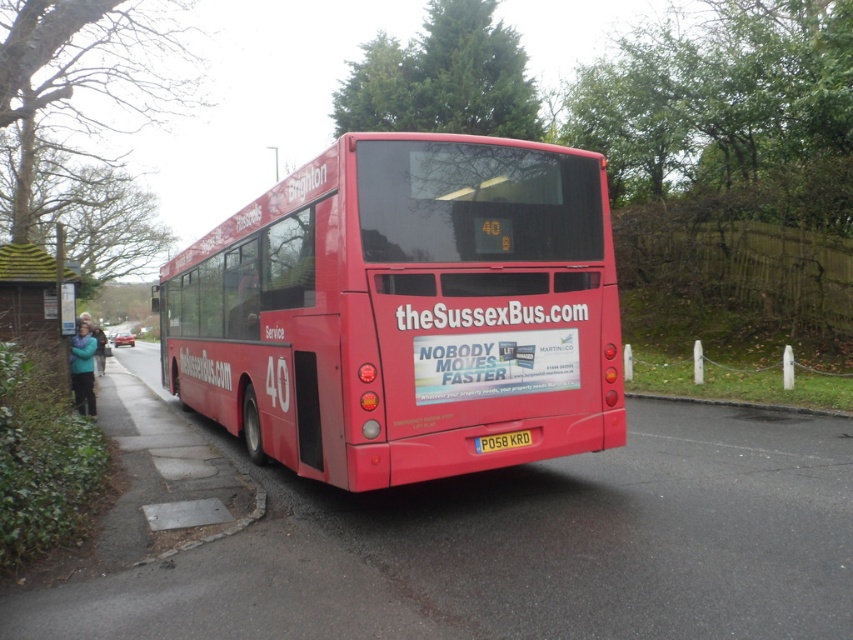
You are standing at the point with coordinates point [19,310] and want to walk to the point with coordinates point [583,355]. Given the scene of the parked red double decker bus, will you be able to see the point you are walking towards throughout your journey?

Since point [583,355] is in front of point [19,310], you will be able to see the point you are walking towards throughout your journey as there are no obstructions mentioned in the scene description.

You are a delivery person trying to attach a new license plate to the yellow plastic license plate at center. However, there is a wooden thatched roof at left nearby. Can you easily replace the license plate without moving the roof?

The wooden thatched roof at left is taller than the yellow plastic license plate at center, so you cannot easily replace the license plate without moving the roof because the roof is taller and may obstruct access.